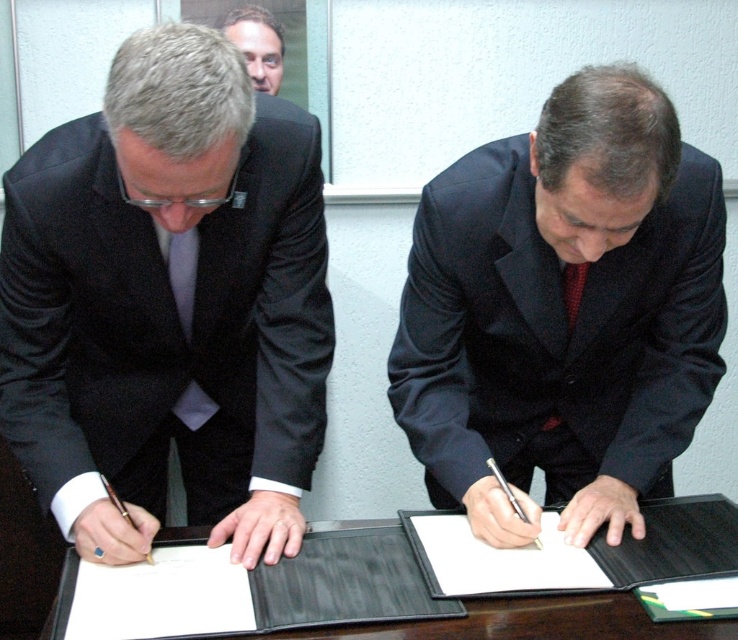
You are attending a formal signing event and notice two men seated at a table. You see the matte black suit at left and the red dotted tie at center. Which object is taller?

The matte black suit at left is much taller than the red dotted tie at center.

You are a photographer at the signing event. You need to place a small microphone exactly at point (168, 304). The microphone is 2 cm in diameter. The matte black suit at left is 40 cm wide. Will the microphone fit entirely on the matte black suit at left without overlapping its edges?

The point (168, 304) is on the matte black suit at left, and the suit is 40 cm wide. Since the microphone is only 2 cm in diameter, it will fit entirely on the matte black suit at left without overlapping its edges.

You are attending a formal signing event and notice two individuals in dark blue suit at center and matte black suit at upper center. Based on their positions, which one is closer to the bottom of the image?

The dark blue suit at center is below matte black suit at upper center, so the dark blue suit at center is closer to the bottom of the image.